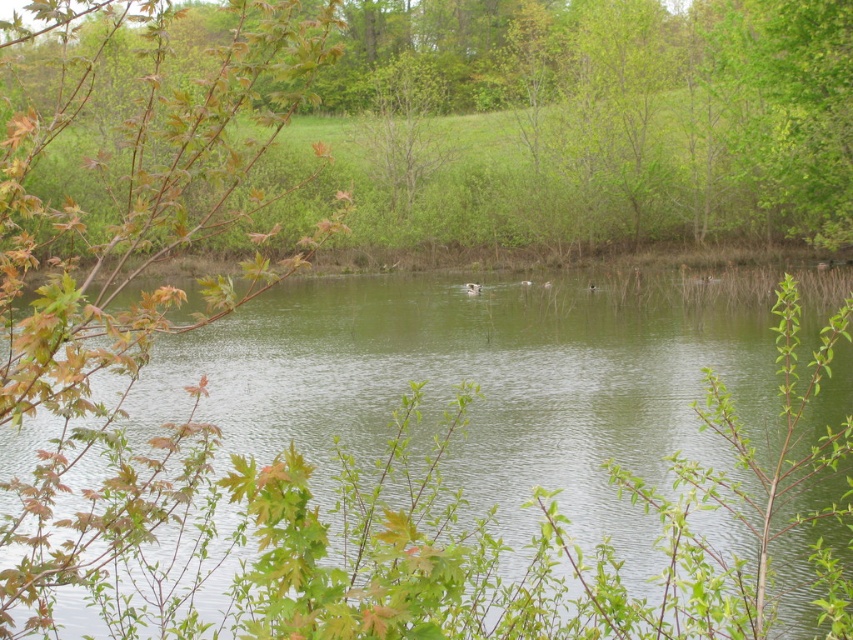
You are standing at the edge of the pond and want to throw a pebble into the green smooth water at center. Based on the coordinates provided, where should you aim to hit the exact center of the water?

The green smooth water at center is located at coordinates point (x=404, y=529), so you should aim for that exact point to hit the center.

You are an ornithologist observing the scene. You notice the green leafy branch at upper left and the white matte duck at center. Which object has a larger size in the image?

The green leafy branch at upper left is bigger than the white matte duck at center.